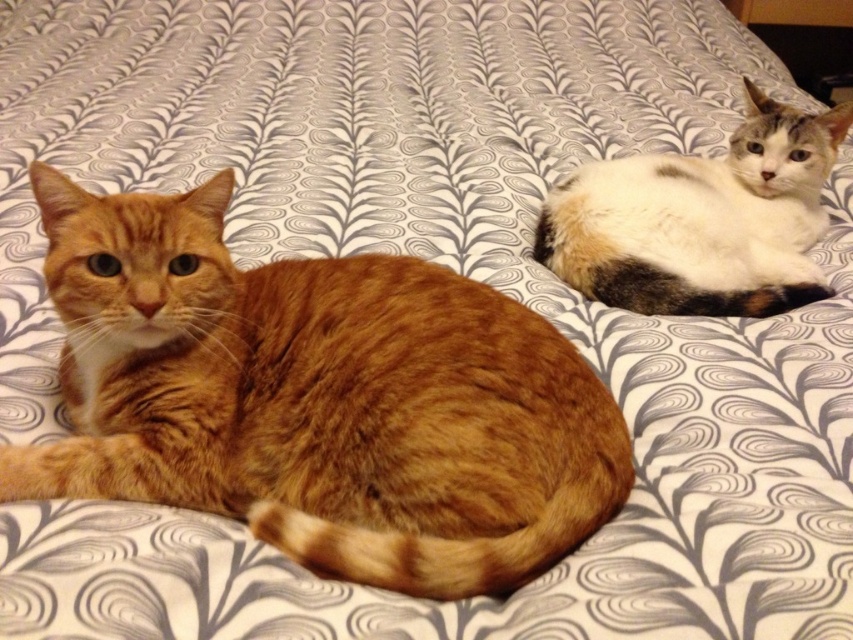
You are a cat owner who wants to place a small toy between the orange fur cat at left and the calico fur cat at upper right. Can you fit the toy in the space between them if the toy requires 20 inches of space?

The distance between the orange fur cat at left and the calico fur cat at upper right is 24.35 inches, which is more than enough to fit the toy requiring 20 inches of space.

You are looking at the bed with the patterned bedsheets. There are two cats there, an orange fur cat at left and a calico fur cat at upper right. Which cat is positioned more to the left side of the bed?

The orange fur cat at left is positioned more to the left side of the bed than the calico fur cat at upper right.

You are a photographer wanting to capture a closeup of the orange fur cat at left and calico fur cat at upper right. Which cat should you focus on first if you want to ensure both are in focus without moving the camera?

The orange fur cat at left is below calico fur cat at upper right, so focusing on the orange fur cat at left first will ensure both are in focus since it is closer to the camera.